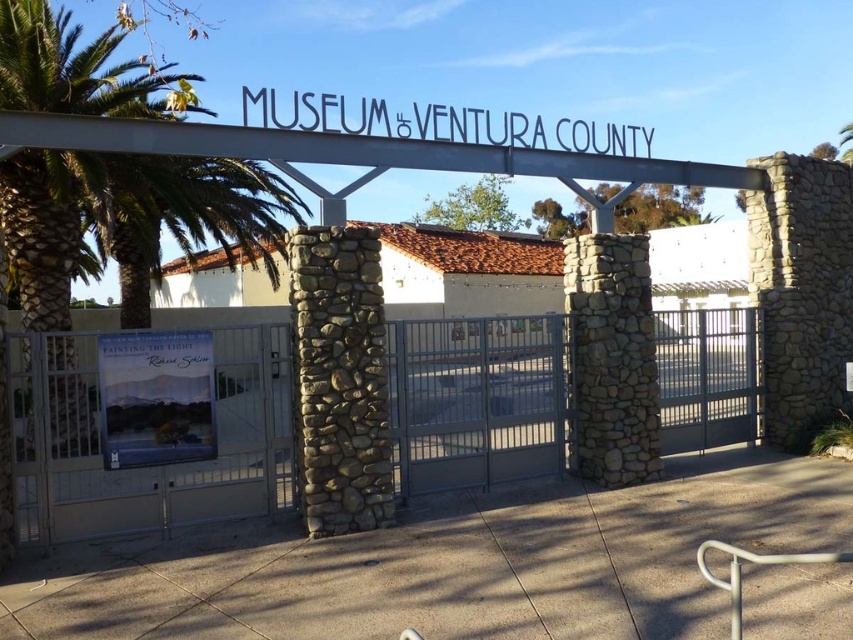
Question: Can you confirm if matte paper poster at center is smaller than white metal sign at center?

Choices:
 (A) no
 (B) yes

Answer: (B)

Question: Which point is closer to the camera?

Choices:
 (A) matte paper poster at center
 (B) white metal sign at center
 (C) metallic gray fence at center

Answer: (C)

Question: Observing the image, what is the correct spatial positioning of matte paper poster at center in reference to white metal sign at center?

Choices:
 (A) right
 (B) left

Answer: (B)

Question: Which object appears closest to the camera in this image?

Choices:
 (A) metallic gray fence at center
 (B) matte paper poster at center
 (C) white metal sign at center

Answer: (A)

Question: Is matte paper poster at center closer to camera compared to white metal sign at center?

Choices:
 (A) no
 (B) yes

Answer: (B)

Question: Which object is positioned farthest from the metallic gray fence at center?

Choices:
 (A) white metal sign at center
 (B) matte paper poster at center

Answer: (A)